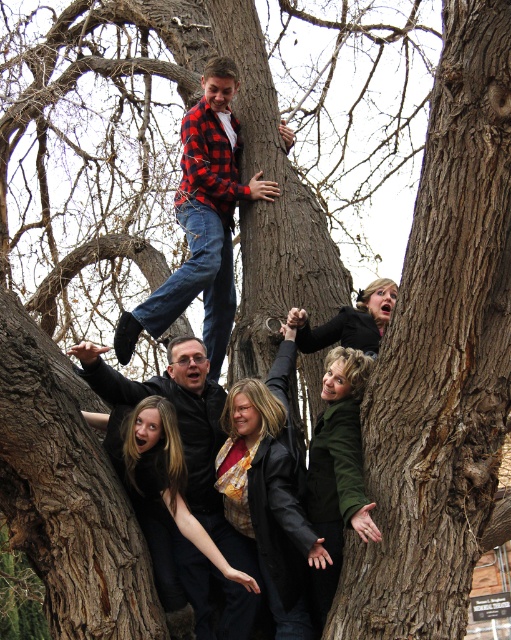
You are a photographer trying to capture the red plaid shirt at upper center in the frame. Based on the coordinates provided, can you determine if the shirt is positioned towards the left or right side of the image?

The red plaid shirt at upper center is located at point (202, 221), which means it is positioned towards the left side of the image since the x coordinate is less than 0.5.

Based on the photo, you are a photographer trying to capture the best angle of the scene. You notice two shirts in the image, the red plaid shirt at upper center and the plaid flannel shirt at center. Which shirt should you focus on if you want to emphasize the size difference between them?

The red plaid shirt at upper center is larger in size compared to the plaid flannel shirt at center, so focusing on the red plaid shirt at upper center would better emphasize the size difference between them.